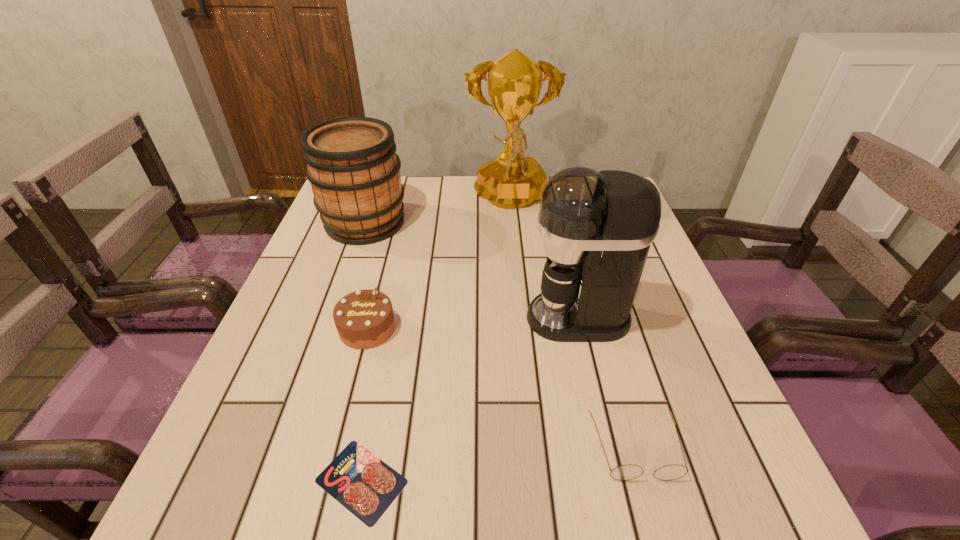
At what (x,y) coordinates should I click in order to perform the action: click on free space between the spectacles and the chocolate cake. Please return your answer as a coordinate pair (x, y). Looking at the image, I should click on (501, 388).

Locate an element on the screen. This screenshot has width=960, height=540. vacant region between the fourth shortest object and the award is located at coordinates (438, 211).

Where is `vacant area between the fifth shortest object and the fifth tallest object`? vacant area between the fifth shortest object and the fifth tallest object is located at coordinates (607, 383).

Where is `vacant area that lies between the third tallest object and the chocolate cake`? This screenshot has width=960, height=540. vacant area that lies between the third tallest object and the chocolate cake is located at coordinates (366, 275).

Locate an element on the screen. vacant space that's between the second shortest object and the cider is located at coordinates (500, 335).

The height and width of the screenshot is (540, 960). In order to click on free area in between the second shortest object and the salami in this screenshot , I will do (x=498, y=464).

Where is `free space between the third shortest object and the shortest object`? This screenshot has width=960, height=540. free space between the third shortest object and the shortest object is located at coordinates (364, 404).

In order to click on vacant point located between the second tallest object and the award in this screenshot , I will do `click(544, 259)`.

Find the location of `object that is the closest to the second shortest object`. object that is the closest to the second shortest object is located at coordinates (597, 227).

The image size is (960, 540). What are the coordinates of `object that stands as the second closest to the fourth tallest object` in the screenshot? It's located at (352, 166).